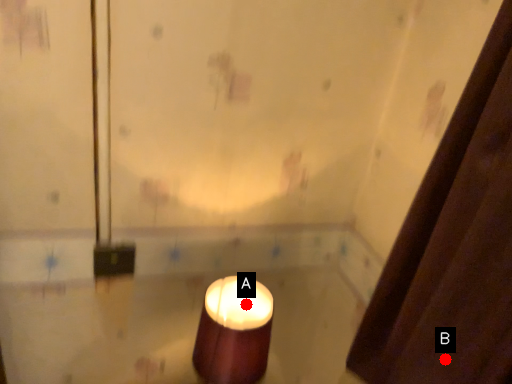
Question: Two points are circled on the image, labeled by A and B beside each circle. Which point is closer to the camera?

Choices:
 (A) A is closer
 (B) B is closer

Answer: (B)